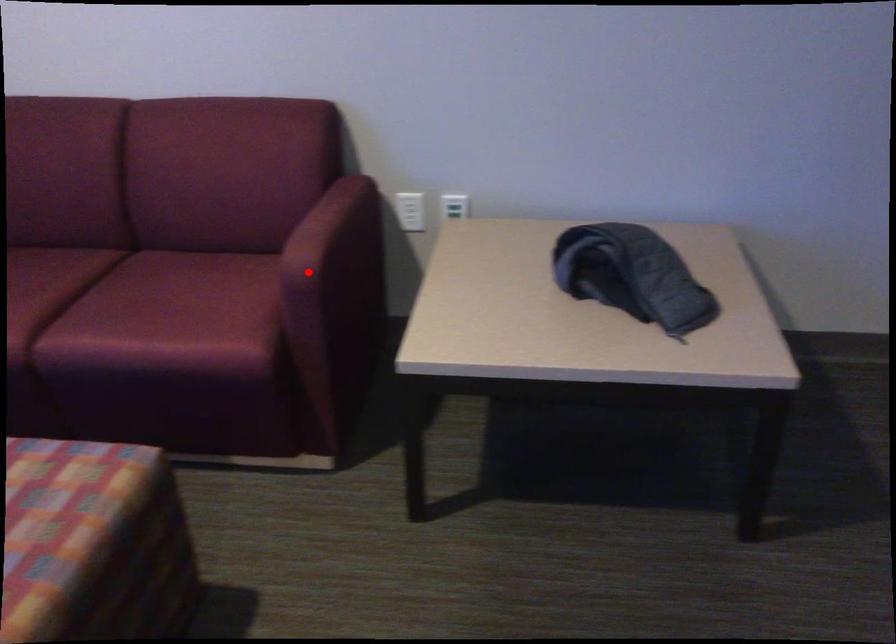
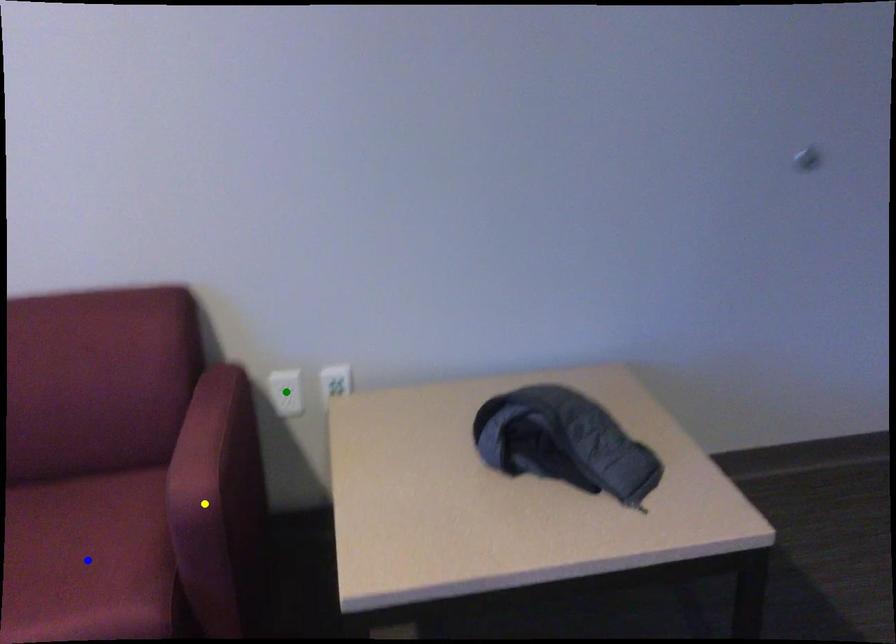
Question: I am providing you with two images of the same scene from different viewpoints. A red point is marked on the first image. You are given multiple points on the second image. Which point in image 2 is actually the same real-world point as the red point in image 1?

Choices:
 (A) green point
 (B) yellow point
 (C) blue point

Answer: (B)